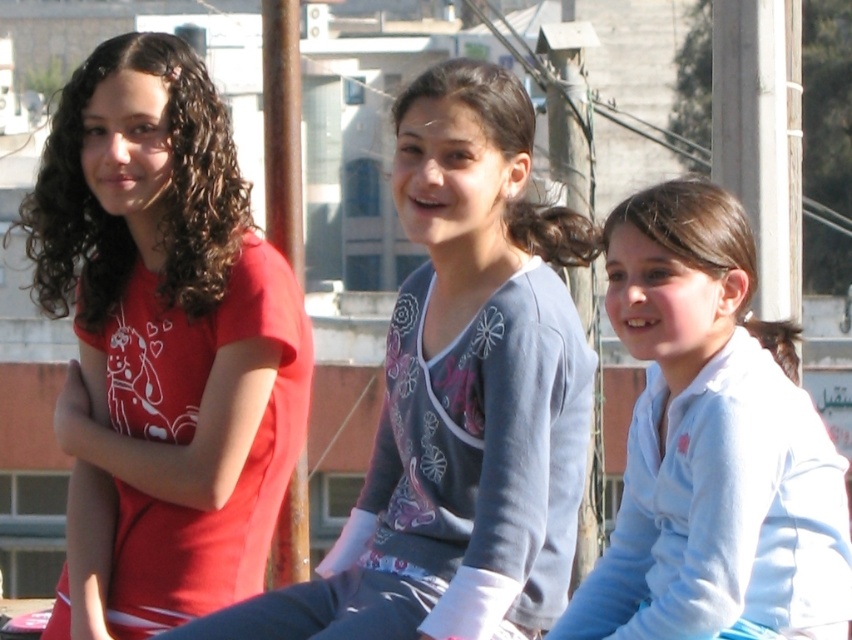
Question: Is matte red t-shirt at left to the right of matte pink shirt at center from the viewer's perspective?

Choices:
 (A) no
 (B) yes

Answer: (A)

Question: Which point is farther from the camera taking this photo?

Choices:
 (A) (752, 362)
 (B) (79, 168)

Answer: (B)

Question: Can you confirm if matte pink shirt at center is positioned below white fleece jacket at lower right?

Choices:
 (A) no
 (B) yes

Answer: (A)

Question: Does matte red t-shirt at left appear on the left side of matte pink shirt at center?

Choices:
 (A) no
 (B) yes

Answer: (B)

Question: Which object is the closest to the matte pink shirt at center?

Choices:
 (A) white fleece jacket at lower right
 (B) matte red t-shirt at left

Answer: (A)

Question: Which point is farther to the camera?

Choices:
 (A) white fleece jacket at lower right
 (B) matte pink shirt at center

Answer: (A)